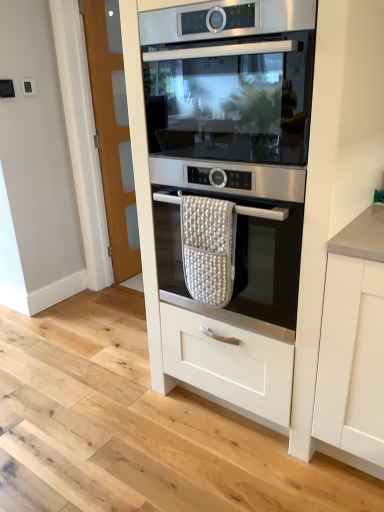
Find the location of a particular element. The image size is (384, 512). free spot to the left of stainless steel oven at center, which is counted as the first oven, starting from the top is located at coordinates (113, 407).